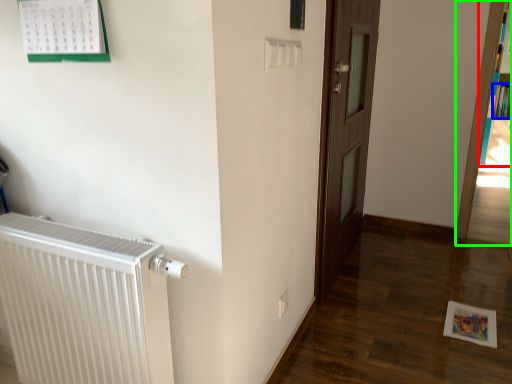
Question: Based on their relative distances, which object is farther from bookcase (highlighted by a red box)? Choose from book (highlighted by a blue box) and bookcase (highlighted by a green box).

Choices:
 (A) book
 (B) bookcase

Answer: (B)